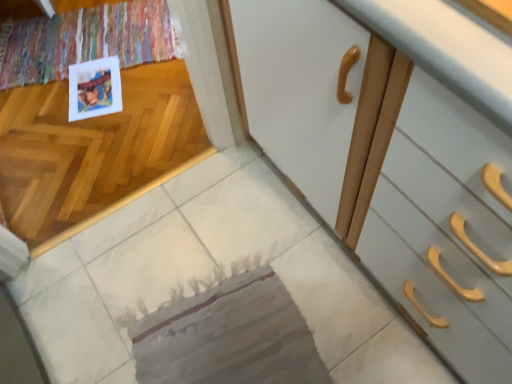
Question: Is matte paper postcard at upper left facing away from textured gray mat at center?

Choices:
 (A) yes
 (B) no

Answer: (B)

Question: Considering the relative sizes of matte paper postcard at upper left and textured gray mat at center in the image provided, is matte paper postcard at upper left taller than textured gray mat at center?

Choices:
 (A) yes
 (B) no

Answer: (A)

Question: Is matte paper postcard at upper left in front of textured gray mat at center?

Choices:
 (A) no
 (B) yes

Answer: (A)

Question: Are matte paper postcard at upper left and textured gray mat at center located far from each other?

Choices:
 (A) yes
 (B) no

Answer: (B)

Question: From the image's perspective, is matte paper postcard at upper left above textured gray mat at center?

Choices:
 (A) no
 (B) yes

Answer: (B)

Question: Does matte paper postcard at upper left have a larger size compared to textured gray mat at center?

Choices:
 (A) no
 (B) yes

Answer: (A)

Question: Is textured gray mat at center not close to matte paper postcard at upper left?

Choices:
 (A) no
 (B) yes

Answer: (A)

Question: From the image's perspective, is textured gray mat at center located beneath matte paper postcard at upper left?

Choices:
 (A) yes
 (B) no

Answer: (A)

Question: Considering the relative sizes of textured gray mat at center and matte paper postcard at upper left in the image provided, is textured gray mat at center thinner than matte paper postcard at upper left?

Choices:
 (A) yes
 (B) no

Answer: (B)

Question: Is textured gray mat at center further to the viewer compared to matte paper postcard at upper left?

Choices:
 (A) yes
 (B) no

Answer: (B)

Question: From the image's perspective, is textured gray mat at center over matte paper postcard at upper left?

Choices:
 (A) yes
 (B) no

Answer: (B)

Question: Can you confirm if textured gray mat at center is taller than matte paper postcard at upper left?

Choices:
 (A) no
 (B) yes

Answer: (A)

Question: Is point (225, 299) closer or farther from the camera than point (109, 61)?

Choices:
 (A) closer
 (B) farther

Answer: (A)